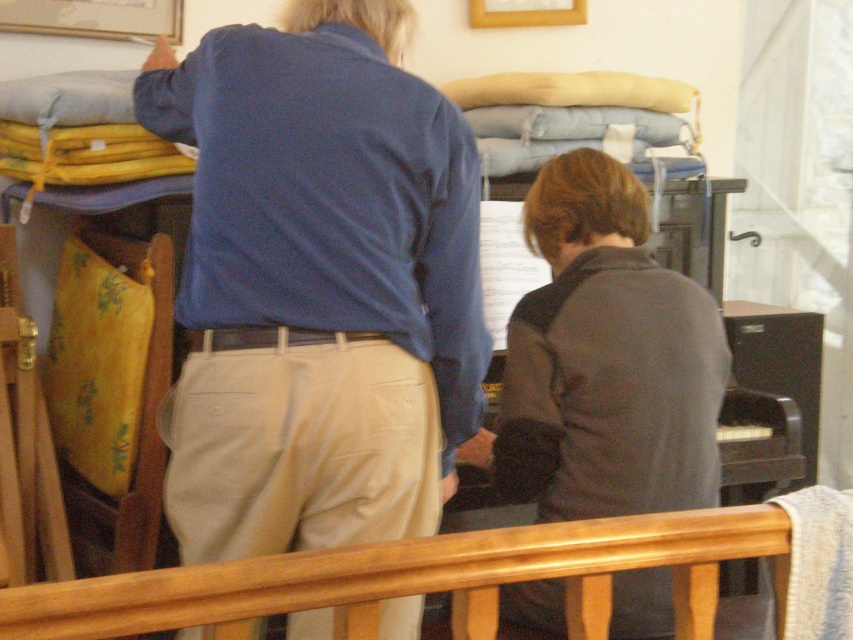
You are standing in the room and want to reach the wooden rail at lower center without moving the blue cotton shirt at upper center. Is it possible?

The blue cotton shirt at upper center is further to the viewer than wooden rail at lower center, so the wooden rail at lower center is behind the blue cotton shirt at upper center. Therefore, you cannot reach the wooden rail at lower center without moving the blue cotton shirt at upper center.

You are a guest at a party and want to sit on the wooden rail at lower center. Can you sit there without moving the dark gray sweater at center?

The wooden rail at lower center is behind the dark gray sweater at center, so you can sit on the wooden rail at lower center without moving the dark gray sweater at center because it is positioned behind it.

You are a photographer setting up a shoot in this room. You need to decide where to place a spotlight so that both the blue cotton shirt at upper center and the dark gray sweater at center are well lit. Considering their heights, which object should be placed higher on the stand to ensure proper lighting?

The blue cotton shirt at upper center has a greater height compared to the dark gray sweater at center, so the spotlight for the blue cotton shirt at upper center should be placed higher on the stand to ensure proper lighting.